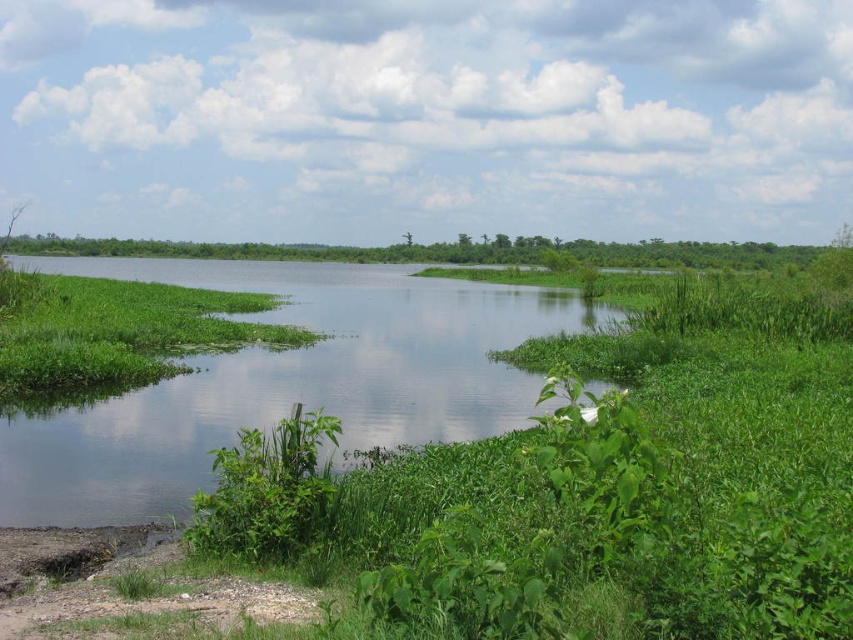
Does green grassy river at center lie behind green grassy land at center?

That is False.

Who is more forward, [428,353] or [294,250]?

Point [428,353]

Is point (222, 403) behind point (33, 250)?

No, it is in front of (33, 250).

I want to click on green grassy river at center, so click(x=283, y=381).